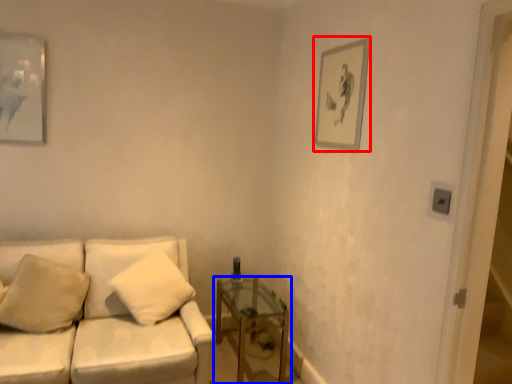
Question: Which of the following is the farthest to the observer, picture frame (highlighted by a red box) or table (highlighted by a blue box)?

Choices:
 (A) picture frame
 (B) table

Answer: (B)